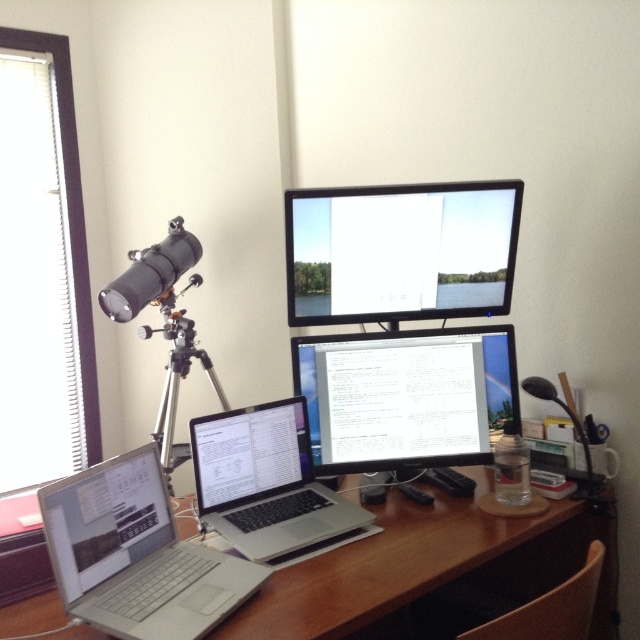
You are a delivery person standing at the entrance of the office. You need to place a package on the desk without moving any of the electronic devices. The package is 1.8 meters long. Can you fit it on the desk between the matte black monitor at upper center and the edge of the desk?

The distance between the matte black monitor at upper center and the camera is 1.75 meters. Since the package is 1.8 meters long, it cannot fit in the available space.

You are sitting at the desk and need to reach both the silver metallic laptop at lower left and the silver metallic laptop at center. Which one is closer to you?

The silver metallic laptop at lower left is closer to you because it is positioned below the silver metallic laptop at center, meaning it is nearer to your seated position.